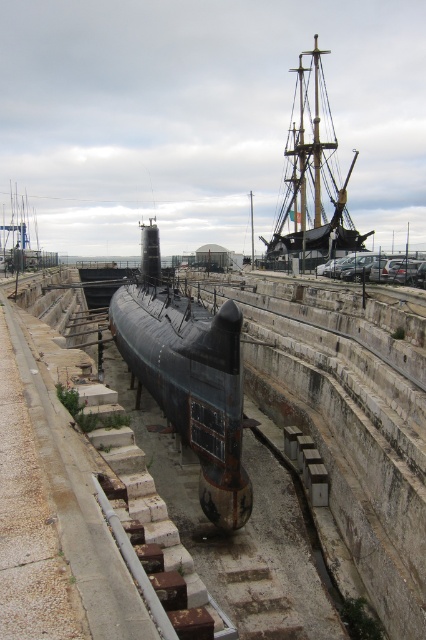
You are an engineer inspecting the dockyard. You need to determine which object is taller between the rusty metal submarine at center and the rusty metal ship at upper right. Based on the scene, which one is taller?

The rusty metal submarine at center is not as tall as the rusty metal ship at upper right, so the rusty metal ship at upper right is taller.

You are a technician working on the submarine in the dry dock. You need to move from your current position at point (348, 228) to reach a tool located at point (152, 358). Which direction should you move relative to your current position?

You should move forward to reach the tool at point (152, 358) because it is located in front of your current position at point (348, 228).

You are standing at the naval dockyard and want to take a photo of both the rusty metal submarine at center and the rusty metal ship at upper right. Which one will appear larger in your photo?

The rusty metal submarine at center will appear larger in the photo because it is closer to the viewer than the rusty metal ship at upper right.